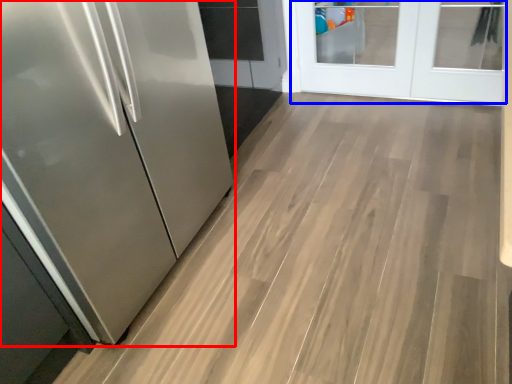
Question: Which of the following is the farthest to the observer, refrigerator (highlighted by a red box) or door (highlighted by a blue box)?

Choices:
 (A) refrigerator
 (B) door

Answer: (B)